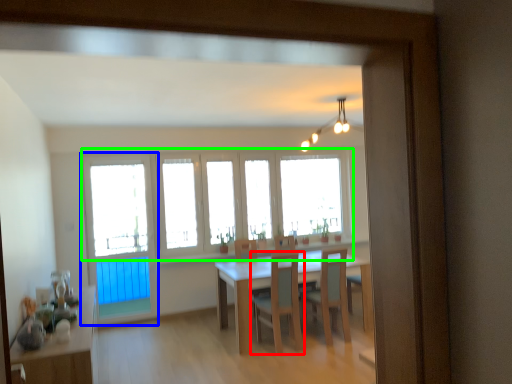
Question: Based on their relative distances, which object is farther from chair (highlighted by a red box)? Choose from screen door (highlighted by a blue box) and window (highlighted by a green box).

Choices:
 (A) screen door
 (B) window

Answer: (A)